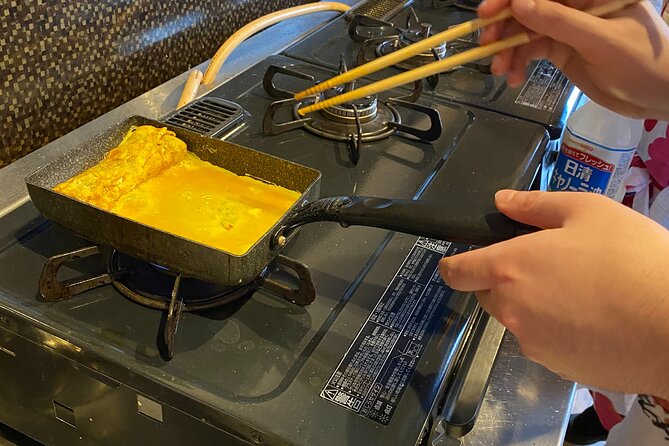
Locate an element on the screen. The image size is (669, 446). stove burner is located at coordinates (364, 110), (399, 36).